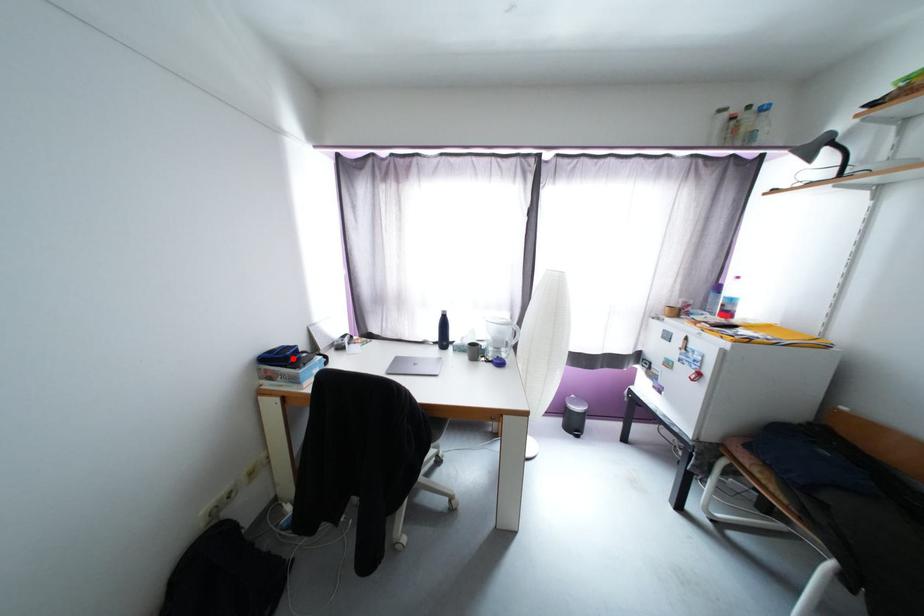
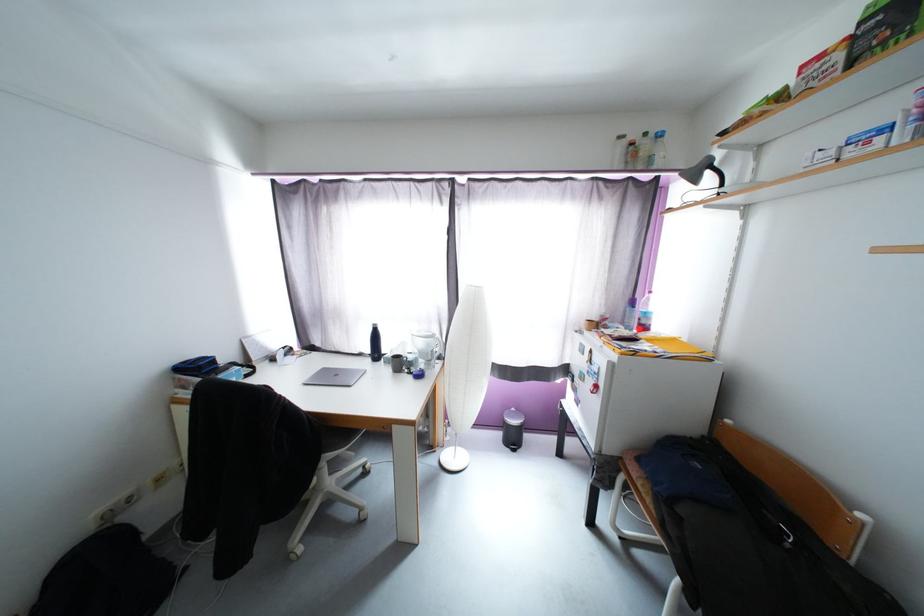
Question: I am providing you with two images of the same scene from different viewpoints. Given a red point in image1, look at the same physical point in image2. Is it:

Choices:
 (A) Closer to the viewpoint
 (B) Farther from the viewpoint

Answer: (B)